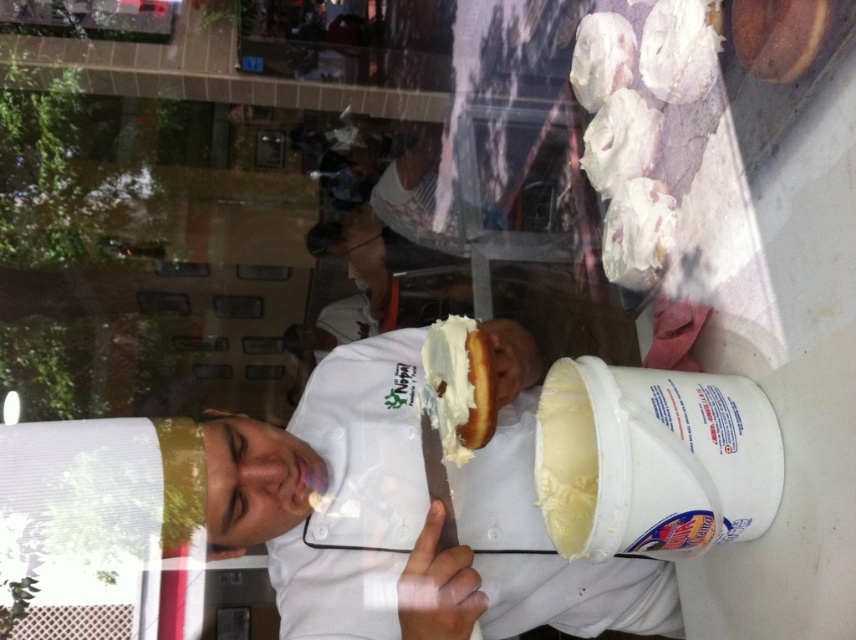
Question: Which point is farther to the camera?

Choices:
 (A) (586, 80)
 (B) (480, 332)
 (C) (633, 508)

Answer: (A)

Question: Estimate the real-world distances between objects in this image. Which object is farther from the white fluffy doughnut at upper center?

Choices:
 (A) white fluffy doughnut at upper right
 (B) white creamy pastry at upper right

Answer: (B)

Question: Does yellow creamy tub at right appear over white fluffy doughnut at upper center?

Choices:
 (A) yes
 (B) no

Answer: (B)

Question: Which object is the farthest from the yellow creamy tub at right?

Choices:
 (A) white creamy pastry at upper right
 (B) white fluffy doughnut at upper right
 (C) brown matte donut at upper right

Answer: (C)

Question: Can you confirm if white creamy donut at center is positioned above white creamy pastry at upper right?

Choices:
 (A) no
 (B) yes

Answer: (A)

Question: Is yellow creamy tub at right smaller than white fluffy doughnut at upper center?

Choices:
 (A) yes
 (B) no

Answer: (B)